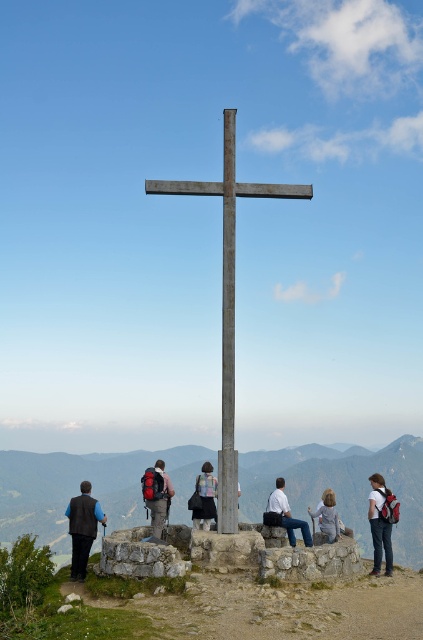
You are a photographer standing at the mountain summit. You want to take a photo of the rustic wood cross at center and the light blue jeans at center. Which object is positioned to the left of the other?

The rustic wood cross at center is to the left of the light blue jeans at center.

You are a photographer trying to capture a shot of the light blue jeans at center and the smooth stone cross at center. According to the scene, which object is positioned to the left of the other?

The smooth stone cross at center is to the left of the light blue jeans at center.